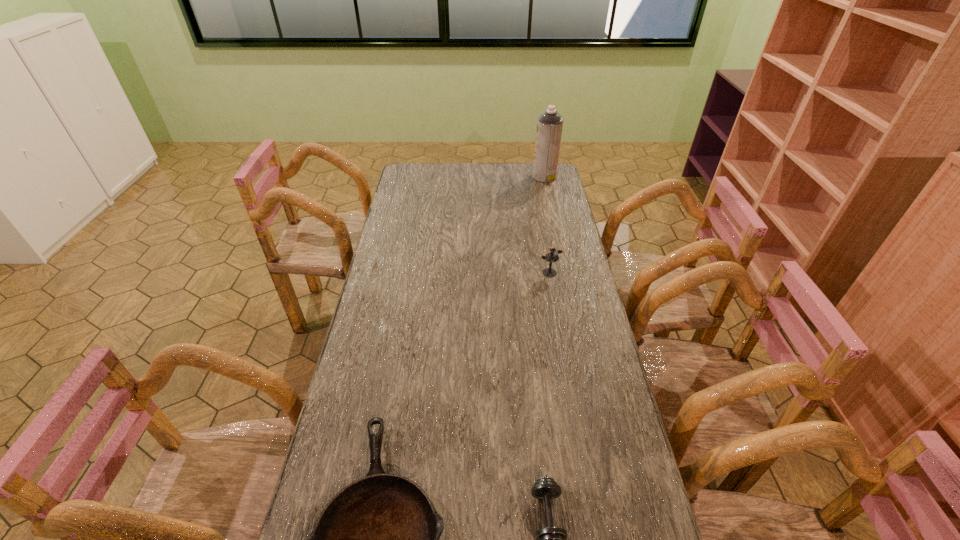
Image resolution: width=960 pixels, height=540 pixels. In the image, there is a desktop. Identify the location of vacant space at the far edge. (516, 181).

Identify the location of vacant space at the left edge. The width and height of the screenshot is (960, 540). (397, 273).

In the image, there is a desktop. Identify the location of free region at the right edge. The width and height of the screenshot is (960, 540). pyautogui.click(x=580, y=272).

Find the location of a particular element. vacant space at the far left corner is located at coordinates (431, 180).

Locate an element on the screen. vacant space that's between the second tallest object and the tallest object is located at coordinates (547, 225).

Locate an element on the screen. vacant region between the third nearest object and the tallest object is located at coordinates (547, 225).

Locate which object ranks third in proximity to the shortest object. Please provide its 2D coordinates. Your answer should be formatted as a tuple, i.e. [(x, y)], where the tuple contains the x and y coordinates of a point satisfying the conditions above.

[(550, 123)]

Identify which object is the nearest to the candle holder. Please provide its 2D coordinates. Your answer should be formatted as a tuple, i.e. [(x, y)], where the tuple contains the x and y coordinates of a point satisfying the conditions above.

[(550, 123)]